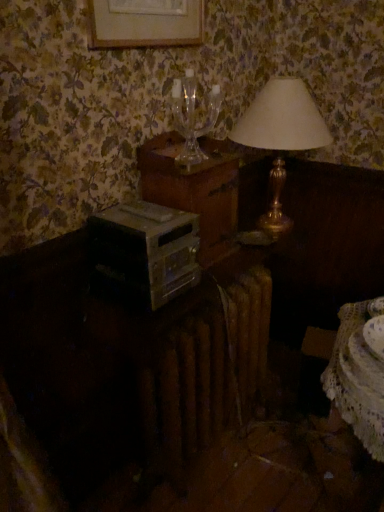
Locate an element on the screen. This screenshot has height=512, width=384. gold metallic lamp at upper right is located at coordinates (280, 137).

What is the approximate width of gold metallic lamp at upper right?

gold metallic lamp at upper right is 31.98 centimeters in width.

What is the approximate height of wooden nightstand at center?

13.92 inches.

This screenshot has height=512, width=384. What do you see at coordinates (193, 116) in the screenshot? I see `transparent glass wine glass at upper center` at bounding box center [193, 116].

Describe the element at coordinates (359, 372) in the screenshot. I see `white lace table at lower right` at that location.

Locate an element on the screen. This screenshot has width=384, height=512. gold metallic lamp at upper right is located at coordinates (280, 137).

Is transparent glass wine glass at upper center bigger than wooden nightstand at center?

Incorrect, transparent glass wine glass at upper center is not larger than wooden nightstand at center.

Where is `nightstand below the transparent glass wine glass at upper center (from a real-world perspective)`? The width and height of the screenshot is (384, 512). nightstand below the transparent glass wine glass at upper center (from a real-world perspective) is located at coordinates (194, 189).

Is transparent glass wine glass at upper center next to wooden nightstand at center and touching it?

transparent glass wine glass at upper center and wooden nightstand at center are clearly separated.

From a real-world perspective, is transparent glass wine glass at upper center located beneath wooden nightstand at center?

No, from a real-world perspective, transparent glass wine glass at upper center is not beneath wooden nightstand at center.

Who is more distant, transparent glass wine glass at upper center or silver metallic stereo at center?

Positioned behind is transparent glass wine glass at upper center.

Where is `wine glass lying on the right of silver metallic stereo at center`? This screenshot has height=512, width=384. wine glass lying on the right of silver metallic stereo at center is located at coordinates (193, 116).

Considering the sizes of objects transparent glass wine glass at upper center and silver metallic stereo at center in the image provided, who is bigger, transparent glass wine glass at upper center or silver metallic stereo at center?

Bigger between the two is silver metallic stereo at center.

Is transparent glass wine glass at upper center shorter than silver metallic stereo at center?

No, transparent glass wine glass at upper center is not shorter than silver metallic stereo at center.

From a real-world perspective, is wooden nightstand at center above or below white lace table at lower right?

wooden nightstand at center is above white lace table at lower right.

Is white lace table at lower right at the back of wooden nightstand at center?

wooden nightstand at center does not have its back to white lace table at lower right.

Considering the positions of points (201, 234) and (328, 366), is point (201, 234) farther from camera compared to point (328, 366)?

Yes, point (201, 234) is behind point (328, 366).

How many degrees apart are the facing directions of wooden nightstand at center and white lace table at lower right?

The angle between the facing direction of wooden nightstand at center and the facing direction of white lace table at lower right is 95.7 degrees.

Considering the relative sizes of white lace table at lower right and transparent glass wine glass at upper center in the image provided, is white lace table at lower right wider than transparent glass wine glass at upper center?

Correct, the width of white lace table at lower right exceeds that of transparent glass wine glass at upper center.

Consider the image. From the image's perspective, is white lace table at lower right positioned above or below transparent glass wine glass at upper center?

white lace table at lower right is below transparent glass wine glass at upper center.

Is white lace table at lower right surrounding transparent glass wine glass at upper center?

No, transparent glass wine glass at upper center is not inside white lace table at lower right.

Is white lace table at lower right at the left side of transparent glass wine glass at upper center?

A: In fact, white lace table at lower right is to the right of transparent glass wine glass at upper center.

From a real-world perspective, which is physically above, silver metallic stereo at center or wooden nightstand at center?

wooden nightstand at center is physically above.

From the image's perspective, relative to wooden nightstand at center, is silver metallic stereo at center above or below?

silver metallic stereo at center is below wooden nightstand at center.

Considering the relative sizes of silver metallic stereo at center and wooden nightstand at center in the image provided, is silver metallic stereo at center wider than wooden nightstand at center?

Yes, silver metallic stereo at center is wider than wooden nightstand at center.

Based on the photo, which is further, (141,288) or (221,254)?

The point (221,254) is farther from the camera.

Does point (282, 216) lie behind point (135, 234)?

Yes, point (282, 216) is farther from viewer.

Between gold metallic lamp at upper right and silver metallic stereo at center, which one appears on the left side from the viewer's perspective?

From the viewer's perspective, silver metallic stereo at center appears more on the left side.

Who is more distant, gold metallic lamp at upper right or silver metallic stereo at center?

gold metallic lamp at upper right is behind.

Considering the sizes of gold metallic lamp at upper right and silver metallic stereo at center in the image, is gold metallic lamp at upper right wider or thinner than silver metallic stereo at center?

In the image, gold metallic lamp at upper right appears to be wider than silver metallic stereo at center.

Does white lace table at lower right appear on the left side of silver metallic stereo at center?

No.

Could you tell me if white lace table at lower right is facing silver metallic stereo at center?

No, white lace table at lower right is not oriented towards silver metallic stereo at center.

Is white lace table at lower right outside of silver metallic stereo at center?

Yes.

Where is `wine glass that is on the left side of wooden nightstand at center`? wine glass that is on the left side of wooden nightstand at center is located at coordinates (193, 116).

You are a GUI agent. You are given a task and a screenshot of the screen. Output one action in this format:
    pyautogui.click(x=<x>, y=<y>)
    Task: Click on the wine glass above the silver metallic stereo at center (from the image's perspective)
    
    Given the screenshot: What is the action you would take?
    pyautogui.click(x=193, y=116)

When comparing their distances from transparent glass wine glass at upper center, does white lace table at lower right or gold metallic lamp at upper right seem further?

white lace table at lower right lies further to transparent glass wine glass at upper center than the other object.

Which object lies further to the anchor point white lace table at lower right, transparent glass wine glass at upper center or silver metallic stereo at center?

Based on the image, transparent glass wine glass at upper center appears to be further to white lace table at lower right.

Considering their positions, is gold metallic lamp at upper right positioned further to silver metallic stereo at center than white lace table at lower right?

Among the two, gold metallic lamp at upper right is located further to silver metallic stereo at center.

When comparing their distances from silver metallic stereo at center, does wooden nightstand at center or transparent glass wine glass at upper center seem closer?

Among the two, wooden nightstand at center is located nearer to silver metallic stereo at center.

Considering their positions, is wooden nightstand at center positioned closer to silver metallic stereo at center than gold metallic lamp at upper right?

The object closer to silver metallic stereo at center is wooden nightstand at center.

When comparing their distances from white lace table at lower right, does silver metallic stereo at center or wooden nightstand at center seem further?

wooden nightstand at center lies further to white lace table at lower right than the other object.

When comparing their distances from silver metallic stereo at center, does gold metallic lamp at upper right or transparent glass wine glass at upper center seem further?

Among the two, gold metallic lamp at upper right is located further to silver metallic stereo at center.

Estimate the real-world distances between objects in this image. Which object is closer to transparent glass wine glass at upper center, gold metallic lamp at upper right or silver metallic stereo at center?

The object closer to transparent glass wine glass at upper center is gold metallic lamp at upper right.

At what (x,y) coordinates should I click in order to perform the action: click on lamp between transparent glass wine glass at upper center and white lace table at lower right from top to bottom. Please return your answer as a coordinate pair (x, y). Looking at the image, I should click on [280, 137].

Where is `wine glass between silver metallic stereo at center and gold metallic lamp at upper right in the horizontal direction`? The image size is (384, 512). wine glass between silver metallic stereo at center and gold metallic lamp at upper right in the horizontal direction is located at coordinates (193, 116).

This screenshot has height=512, width=384. I want to click on nightstand between transparent glass wine glass at upper center and white lace table at lower right from top to bottom, so (x=194, y=189).

What are the coordinates of `nightstand between transparent glass wine glass at upper center and silver metallic stereo at center from top to bottom` in the screenshot? It's located at (194, 189).